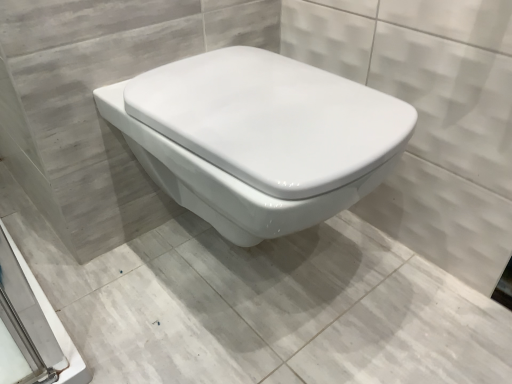
Locate an element on the screen. Image resolution: width=512 pixels, height=384 pixels. white glossy toilet at center is located at coordinates (280, 311).

Image resolution: width=512 pixels, height=384 pixels. What do you see at coordinates (280, 311) in the screenshot? I see `white glossy toilet at center` at bounding box center [280, 311].

Measure the distance between white glossy toilet at center and camera.

A distance of 30.74 inches exists between white glossy toilet at center and camera.

What is the approximate width of white glossy toilet at center?

34.03 inches.

Measure the distance between point (357,220) and camera.

The depth of point (357,220) is 1.13 meters.

You are a GUI agent. You are given a task and a screenshot of the screen. Output one action in this format:
    pyautogui.click(x=<x>, y=<y>)
    Task: Click on the white glossy toilet at center
    Image resolution: width=512 pixels, height=384 pixels.
    Given the screenshot: What is the action you would take?
    click(280, 311)